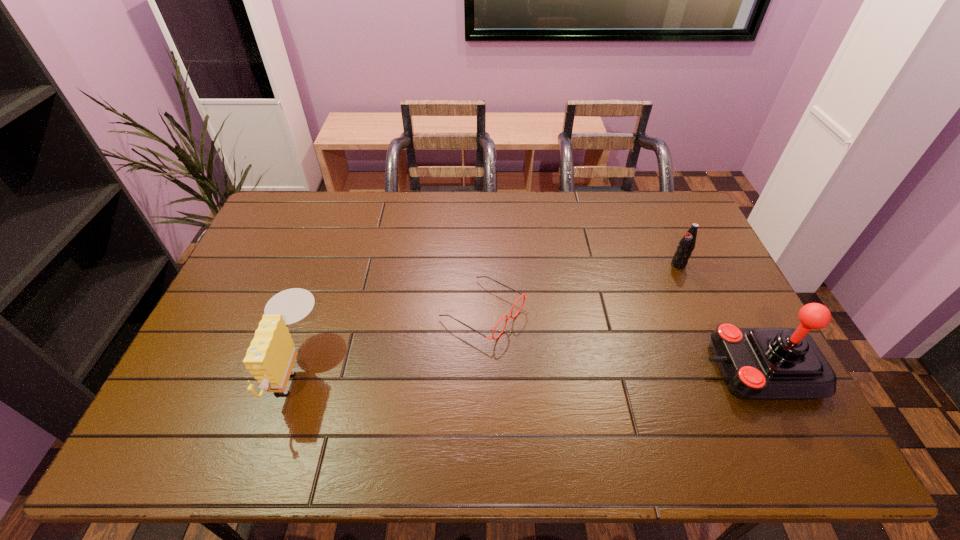
Where is `vacant area between the spectacles and the pop`? This screenshot has width=960, height=540. vacant area between the spectacles and the pop is located at coordinates (581, 288).

You are a GUI agent. You are given a task and a screenshot of the screen. Output one action in this format:
    pyautogui.click(x=<x>, y=<y>)
    Task: Click on the free space between the joystick and the pop
    The image size is (960, 540).
    Given the screenshot: What is the action you would take?
    pyautogui.click(x=719, y=316)

Find the location of a particular element. the closest object to the joystick is located at coordinates (686, 245).

Locate which object ranks third in proximity to the shortest object. Please provide its 2D coordinates. Your answer should be formatted as a tuple, i.e. [(x, y)], where the tuple contains the x and y coordinates of a point satisfying the conditions above.

[(686, 245)]

I want to click on free space that satisfies the following two spatial constraints: 1. on the front side of the tallest object; 2. on the base of the shortest object, so click(483, 368).